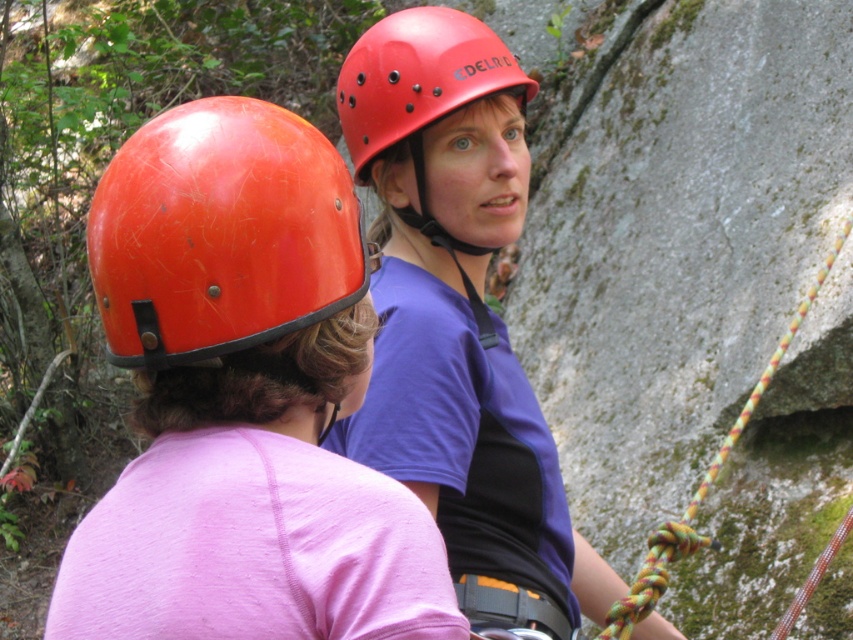
Question: Estimate the real-world distances between objects in this image. Which object is farther from the red matte helmet at center?

Choices:
 (A) orange matte helmet at left
 (B) matte orange helmet at upper center
 (C) multicolored braided rope at right

Answer: (C)

Question: Is the position of matte orange helmet at upper center more distant than that of multicolored braided rope at right?

Choices:
 (A) no
 (B) yes

Answer: (A)

Question: Is matte orange helmet at upper center to the left of orange matte helmet at left from the viewer's perspective?

Choices:
 (A) no
 (B) yes

Answer: (A)

Question: Can you confirm if orange matte helmet at left is positioned to the right of red matte helmet at center?

Choices:
 (A) yes
 (B) no

Answer: (B)

Question: Considering the real-world distances, which object is farthest from the matte orange helmet at upper center?

Choices:
 (A) orange matte helmet at left
 (B) red matte helmet at center
 (C) multicolored braided rope at right

Answer: (C)

Question: Which object appears closest to the camera in this image?

Choices:
 (A) orange matte helmet at left
 (B) matte orange helmet at upper center

Answer: (B)